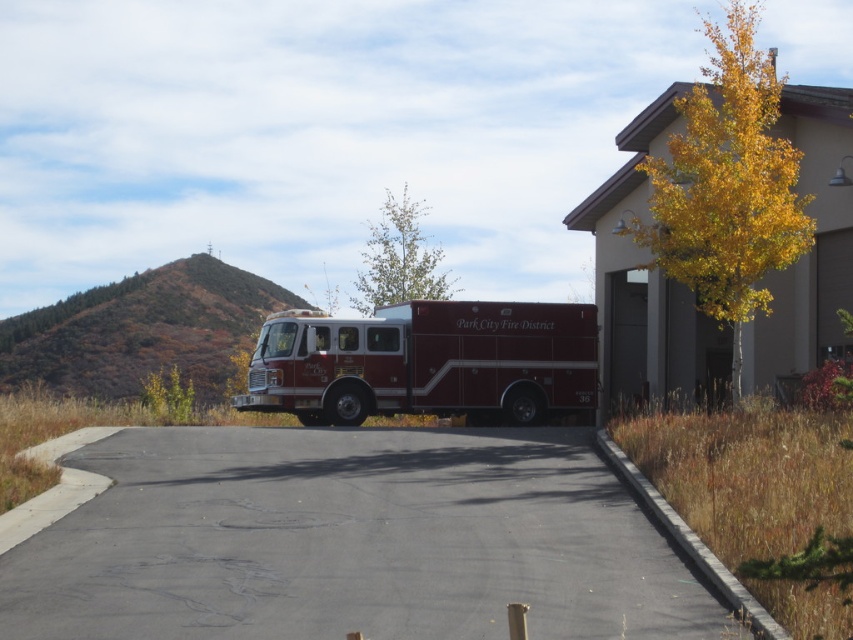
Question: Observing the image, what is the correct spatial positioning of beige concrete fire station at right in reference to shiny red fire truck at center?

Choices:
 (A) right
 (B) left

Answer: (A)

Question: Which point is farther to the camera?

Choices:
 (A) (445, 573)
 (B) (281, 365)
 (C) (788, 269)

Answer: (C)

Question: Which of the following is the farthest from the observer?

Choices:
 (A) beige concrete fire station at right
 (B) shiny red fire truck at center

Answer: (B)

Question: Is black asphalt driveway at center thinner than beige concrete fire station at right?

Choices:
 (A) yes
 (B) no

Answer: (B)

Question: Estimate the real-world distances between objects in this image. Which object is closer to the black asphalt driveway at center?

Choices:
 (A) beige concrete fire station at right
 (B) shiny red fire truck at center

Answer: (B)

Question: Observing the image, what is the correct spatial positioning of black asphalt driveway at center in reference to beige concrete fire station at right?

Choices:
 (A) below
 (B) above

Answer: (A)